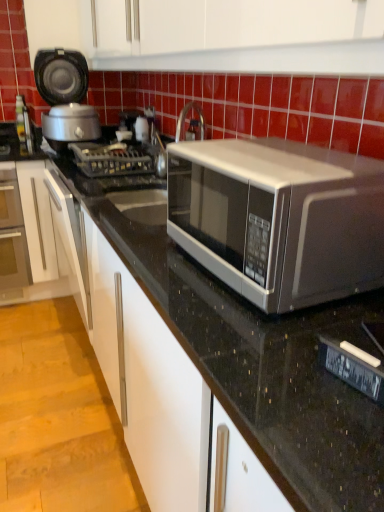
Question: Would you say matte black rice cooker at left contains satin silver microwave at center?

Choices:
 (A) no
 (B) yes

Answer: (A)

Question: Considering the relative positions of matte black rice cooker at left and satin silver microwave at center in the image provided, is matte black rice cooker at left to the left of satin silver microwave at center from the viewer's perspective?

Choices:
 (A) no
 (B) yes

Answer: (B)

Question: From the image's perspective, is matte black rice cooker at left located beneath satin silver microwave at center?

Choices:
 (A) no
 (B) yes

Answer: (A)

Question: Is matte black rice cooker at left wider than satin silver microwave at center?

Choices:
 (A) yes
 (B) no

Answer: (A)

Question: Could you tell me if matte black rice cooker at left is facing satin silver microwave at center?

Choices:
 (A) no
 (B) yes

Answer: (B)

Question: Visually, is matte black rice cooker at left positioned to the left or to the right of satin silver microwave at center?

Choices:
 (A) right
 (B) left

Answer: (B)

Question: Considering their positions, is matte black rice cooker at left located in front of or behind satin silver microwave at center?

Choices:
 (A) behind
 (B) front

Answer: (A)

Question: From a real-world perspective, is matte black rice cooker at left physically located above or below satin silver microwave at center?

Choices:
 (A) above
 (B) below

Answer: (A)

Question: Which is correct: matte black rice cooker at left is inside satin silver microwave at center, or outside of it?

Choices:
 (A) inside
 (B) outside

Answer: (B)

Question: From the image's perspective, relative to matte black rice cooker at left, is metallic gray gas stove at center above or below?

Choices:
 (A) above
 (B) below

Answer: (B)

Question: Considering the positions of metallic gray gas stove at center and matte black rice cooker at left in the image, is metallic gray gas stove at center wider or thinner than matte black rice cooker at left?

Choices:
 (A) thin
 (B) wide

Answer: (B)

Question: Considering their positions, is metallic gray gas stove at center located in front of or behind matte black rice cooker at left?

Choices:
 (A) front
 (B) behind

Answer: (A)

Question: From a real-world perspective, is metallic gray gas stove at center physically located above or below matte black rice cooker at left?

Choices:
 (A) below
 (B) above

Answer: (A)

Question: Based on their positions, is satin silver microwave at center located to the left or right of matte black rice cooker at left?

Choices:
 (A) left
 (B) right

Answer: (B)

Question: Considering the positions of point (248, 144) and point (87, 89), is point (248, 144) closer or farther from the camera than point (87, 89)?

Choices:
 (A) closer
 (B) farther

Answer: (A)